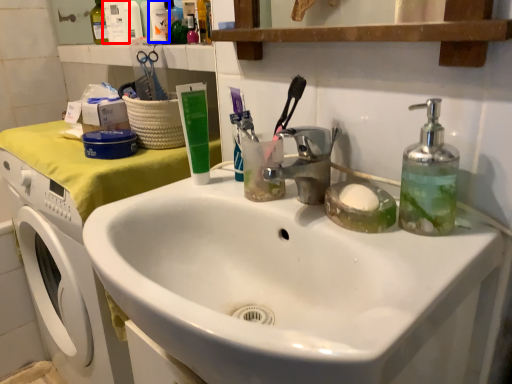
Question: Which of the following is the farthest to the observer, toiletry (highlighted by a red box) or toiletry (highlighted by a blue box)?

Choices:
 (A) toiletry
 (B) toiletry

Answer: (A)